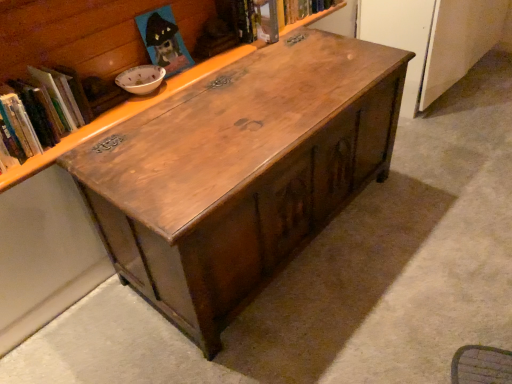
Question: Is wooden chest at center at the right side of hardcover book at upper center, marked as the 2th book in a front-to-back arrangement?

Choices:
 (A) no
 (B) yes

Answer: (A)

Question: Is wooden chest at center shorter than hardcover book at upper center, which is counted as the second book, starting from the bottom?

Choices:
 (A) yes
 (B) no

Answer: (B)

Question: Is wooden chest at center touching hardcover book at upper center, placed as the first book when sorted from back to front?

Choices:
 (A) no
 (B) yes

Answer: (A)

Question: Is wooden chest at center closer to camera compared to hardcover book at upper center, positioned as the 1th book in top-to-bottom order?

Choices:
 (A) yes
 (B) no

Answer: (A)

Question: Does wooden chest at center have a lesser width compared to hardcover book at upper center, marked as the 2th book in a front-to-back arrangement?

Choices:
 (A) no
 (B) yes

Answer: (A)

Question: Is hardcover book at upper center, which is counted as the second book, starting from the bottom, wider or thinner than wooden chest at center?

Choices:
 (A) wide
 (B) thin

Answer: (B)

Question: Looking at the image, does hardcover book at upper center, marked as the 2th book in a front-to-back arrangement, seem bigger or smaller compared to wooden chest at center?

Choices:
 (A) big
 (B) small

Answer: (B)

Question: Is hardcover book at upper center, which is counted as the first book, starting from the right, inside or outside of wooden chest at center?

Choices:
 (A) inside
 (B) outside

Answer: (A)

Question: Is hardcover book at upper center, which is counted as the first book, starting from the right, taller or shorter than wooden chest at center?

Choices:
 (A) tall
 (B) short

Answer: (B)

Question: Is wooden chest at center taller or shorter than hardcover book at upper left, which ranks as the second book in top-to-bottom order?

Choices:
 (A) short
 (B) tall

Answer: (B)

Question: Considering the positions of wooden chest at center and hardcover book at upper left, which appears as the first book when ordered from the bottom, in the image, is wooden chest at center wider or thinner than hardcover book at upper left, which appears as the first book when ordered from the bottom,?

Choices:
 (A) thin
 (B) wide

Answer: (B)

Question: Is wooden chest at center inside or outside of hardcover book at upper left, marked as the second book in a right-to-left arrangement?

Choices:
 (A) inside
 (B) outside

Answer: (B)

Question: From a real-world perspective, is wooden chest at center physically located above or below hardcover book at upper left, marked as the second book in a right-to-left arrangement?

Choices:
 (A) above
 (B) below

Answer: (A)

Question: In the image, is hardcover book at upper center, which is counted as the first book, starting from the right, positioned in front of or behind wooden chest at center?

Choices:
 (A) behind
 (B) front

Answer: (A)

Question: Considering the positions of hardcover book at upper center, which is counted as the second book, starting from the bottom, and wooden chest at center in the image, is hardcover book at upper center, which is counted as the second book, starting from the bottom, taller or shorter than wooden chest at center?

Choices:
 (A) tall
 (B) short

Answer: (B)